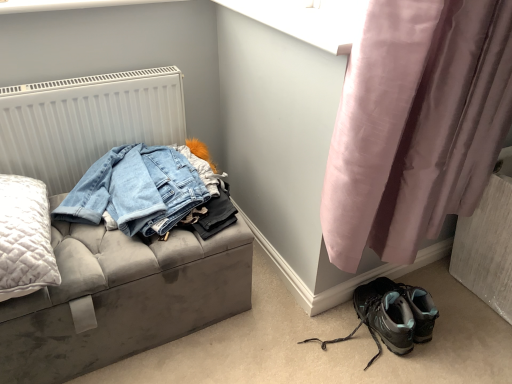
Find the location of `vacant area on top of white textured radiator at upper left (from a real-world perspective)`. vacant area on top of white textured radiator at upper left (from a real-world perspective) is located at coordinates (73, 76).